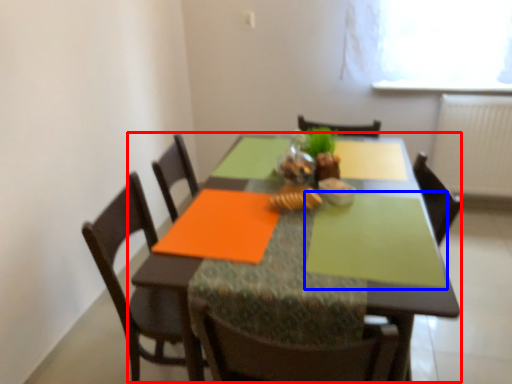
Question: Which object is closer to the camera taking this photo, kitchen & dining room table (highlighted by a red box) or place mat (highlighted by a blue box)?

Choices:
 (A) kitchen & dining room table
 (B) place mat

Answer: (A)